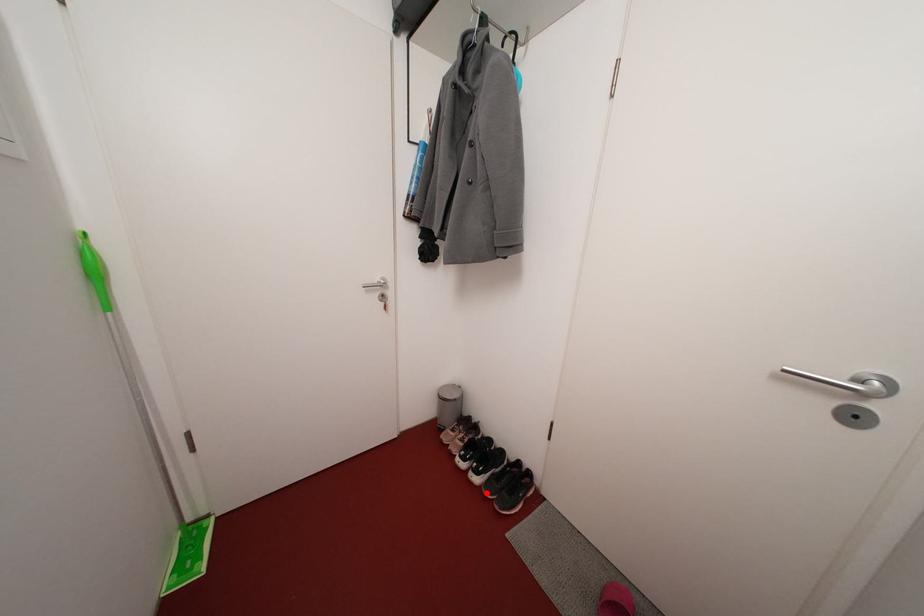
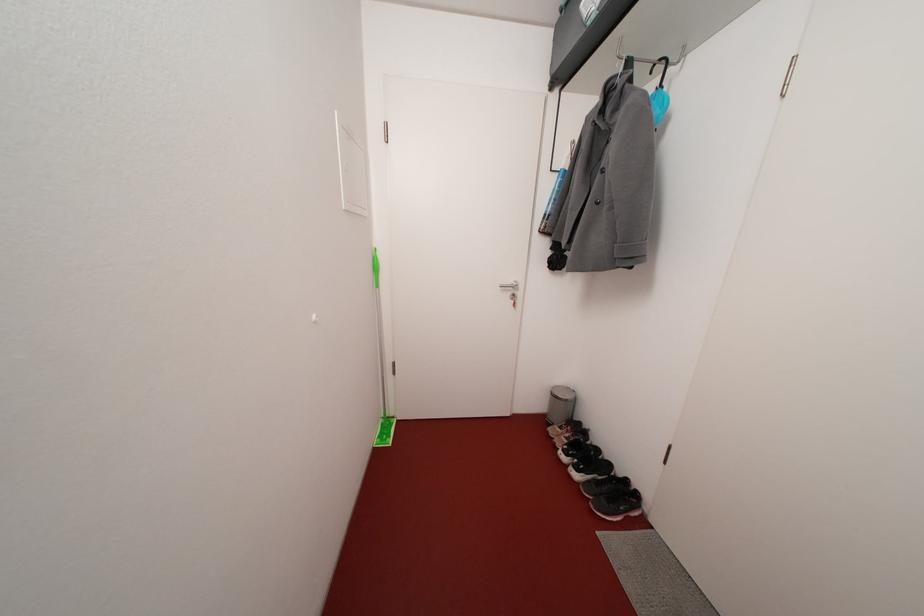
Question: I am providing you with two images of the same scene from different viewpoints. Image1 has a red point marked. In image2, the corresponding 3D location appears at what relative position? Reply with the corresponding letter.

Choices:
 (A) Closer
 (B) Farther

Answer: (A)